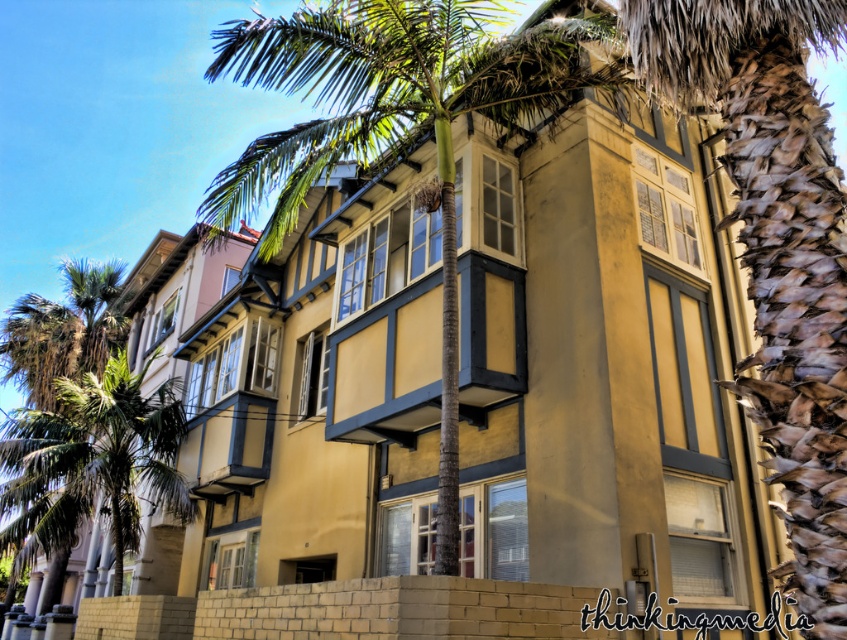
Question: Is brown textured trunk at center-right to the left of green leafy palm tree at left from the viewer's perspective?

Choices:
 (A) yes
 (B) no

Answer: (B)

Question: Which object is closer to the camera taking this photo?

Choices:
 (A) green leafy palm tree at left
 (B) green leafy palm tree at center
 (C) brown textured trunk at center-right

Answer: (C)

Question: Does brown textured trunk at center-right appear on the left side of green leafy palm tree at center?

Choices:
 (A) no
 (B) yes

Answer: (A)

Question: Does green leafy palm tree at center appear on the left side of green leafy palm tree at left?

Choices:
 (A) no
 (B) yes

Answer: (B)

Question: Among these objects, which one is nearest to the camera?

Choices:
 (A) green leafy palm tree at center
 (B) green leafy palm tree at left

Answer: (A)

Question: Among these points, which one is farthest from the camera?

Choices:
 (A) (670, 56)
 (B) (103, 429)
 (C) (411, 148)

Answer: (B)